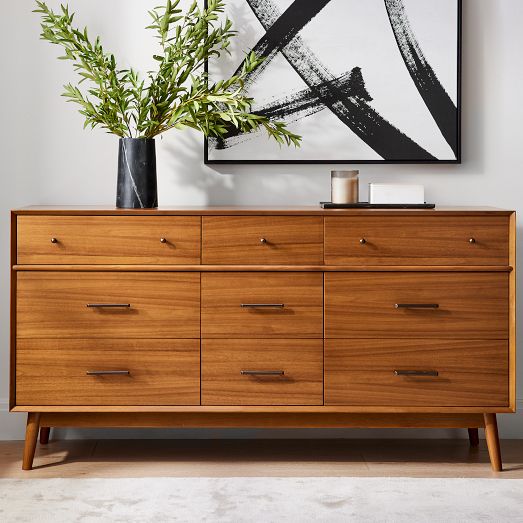
Find the location of a particular element. The image size is (523, 523). black tray is located at coordinates (360, 206).